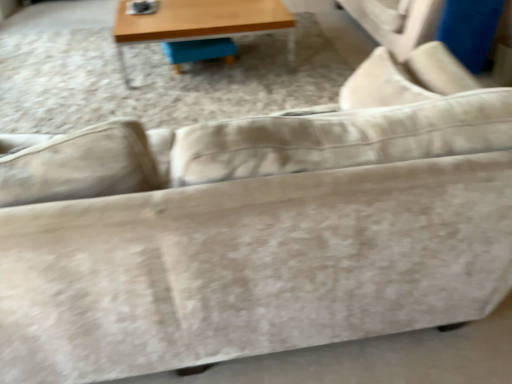
You are a GUI agent. You are given a task and a screenshot of the screen. Output one action in this format:
    pyautogui.click(x=<x>, y=<y>)
    Task: Click on the vacant space to the right of blue fabric swivel chair at center
    
    Given the screenshot: What is the action you would take?
    pyautogui.click(x=253, y=62)